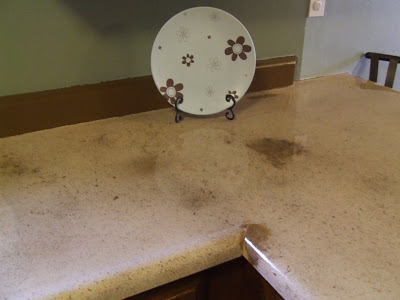
At what (x,y) coordinates should I click in order to perform the action: click on green wall. Please return your answer as a coordinate pair (x, y). Image resolution: width=400 pixels, height=300 pixels. Looking at the image, I should click on (34, 39), (135, 29), (281, 18).